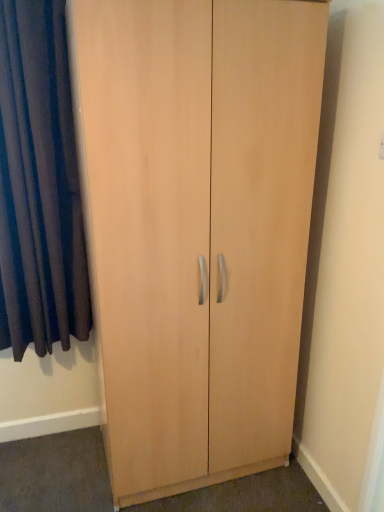
Question: From the image's perspective, does dark blue velvet curtain at left appear higher than light wood cupboard at center?

Choices:
 (A) yes
 (B) no

Answer: (A)

Question: Considering the relative positions of dark blue velvet curtain at left and light wood cupboard at center in the image provided, is dark blue velvet curtain at left behind light wood cupboard at center?

Choices:
 (A) yes
 (B) no

Answer: (A)

Question: Can you confirm if dark blue velvet curtain at left is positioned to the right of light wood cupboard at center?

Choices:
 (A) yes
 (B) no

Answer: (B)

Question: Would you consider dark blue velvet curtain at left to be distant from light wood cupboard at center?

Choices:
 (A) no
 (B) yes

Answer: (A)

Question: From a real-world perspective, is dark blue velvet curtain at left below light wood cupboard at center?

Choices:
 (A) no
 (B) yes

Answer: (A)

Question: Considering the relative sizes of dark blue velvet curtain at left and light wood cupboard at center in the image provided, is dark blue velvet curtain at left wider than light wood cupboard at center?

Choices:
 (A) no
 (B) yes

Answer: (A)

Question: From a real-world perspective, does light wood cupboard at center stand above dark blue velvet curtain at left?

Choices:
 (A) yes
 (B) no

Answer: (B)

Question: Is light wood cupboard at center shorter than dark blue velvet curtain at left?

Choices:
 (A) yes
 (B) no

Answer: (B)

Question: Is light wood cupboard at center wider than dark blue velvet curtain at left?

Choices:
 (A) yes
 (B) no

Answer: (A)

Question: Does light wood cupboard at center have a larger size compared to dark blue velvet curtain at left?

Choices:
 (A) no
 (B) yes

Answer: (B)

Question: Considering the relative sizes of light wood cupboard at center and dark blue velvet curtain at left in the image provided, is light wood cupboard at center taller than dark blue velvet curtain at left?

Choices:
 (A) no
 (B) yes

Answer: (B)

Question: Is light wood cupboard at center oriented away from dark blue velvet curtain at left?

Choices:
 (A) yes
 (B) no

Answer: (B)

Question: Considering the positions of point (56, 236) and point (296, 125), is point (56, 236) closer or farther from the camera than point (296, 125)?

Choices:
 (A) farther
 (B) closer

Answer: (A)